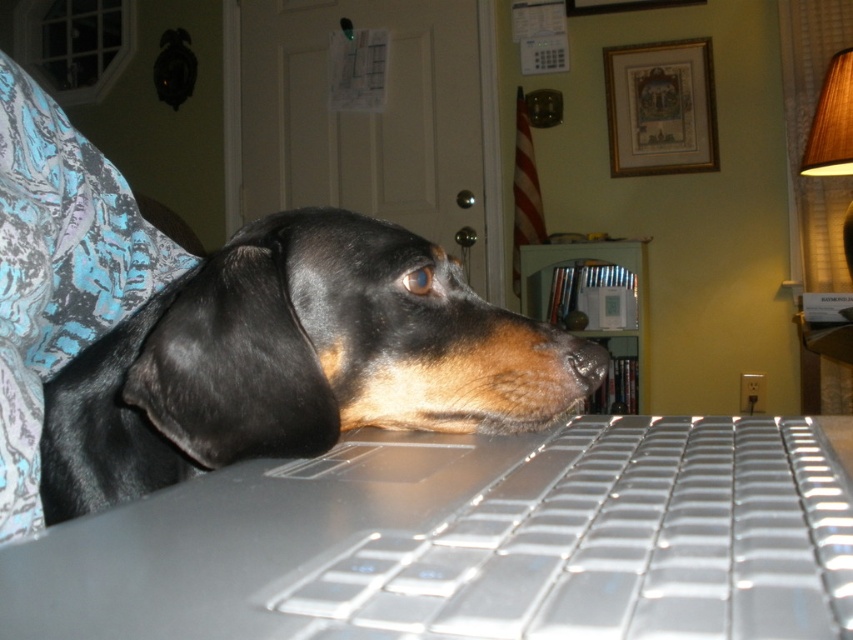
In the scene shown: Does black shiny fur at center have a greater height compared to silver/transparent plastic keyboard at center?

Indeed, black shiny fur at center has a greater height compared to silver/transparent plastic keyboard at center.

Measure the distance between black shiny fur at center and camera.

black shiny fur at center and camera are 17.31 inches apart from each other.

Who is more forward, (90, 390) or (474, 529)?

Point (474, 529)

Identify the location of black shiny fur at center. This screenshot has height=640, width=853. (291, 362).

Who is higher up, black shiny fur at center or brown matte nose at center?

Positioned higher is black shiny fur at center.

Measure the distance between point (293,353) and camera.

Point (293,353) is 47.73 centimeters from camera.

Identify the location of black shiny fur at center. This screenshot has width=853, height=640. (291, 362).

Does silver/transparent plastic keyboard at center appear on the right side of brown matte nose at center?

No, silver/transparent plastic keyboard at center is not to the right of brown matte nose at center.

Who is positioned more to the left, silver/transparent plastic keyboard at center or brown matte nose at center?

silver/transparent plastic keyboard at center

What do you see at coordinates (616, 541) in the screenshot? This screenshot has height=640, width=853. I see `silver/transparent plastic keyboard at center` at bounding box center [616, 541].

Find the location of a particular element. silver/transparent plastic keyboard at center is located at coordinates (616, 541).